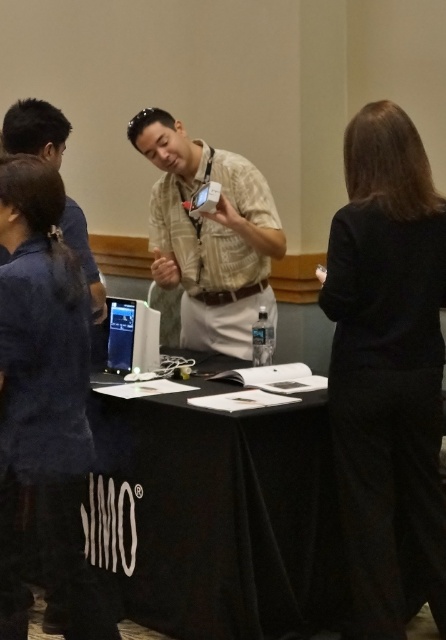
You are attending a conference and notice two items on the table. The dark blue fabric at left and the beige textured shirt at center. Which one is positioned more to the left?

The dark blue fabric at left is positioned more to the left than the beige textured shirt at center.

In the scene shown: You are standing in the conference room and want to place a large presentation folder on the table. Where exactly should you place it on the black fabric table at center to ensure it doesn not obstruct the laptop screen?

The black fabric table at center is located at point (214, 516), so you should place the large presentation folder away from the laptop screen area to avoid obstruction.